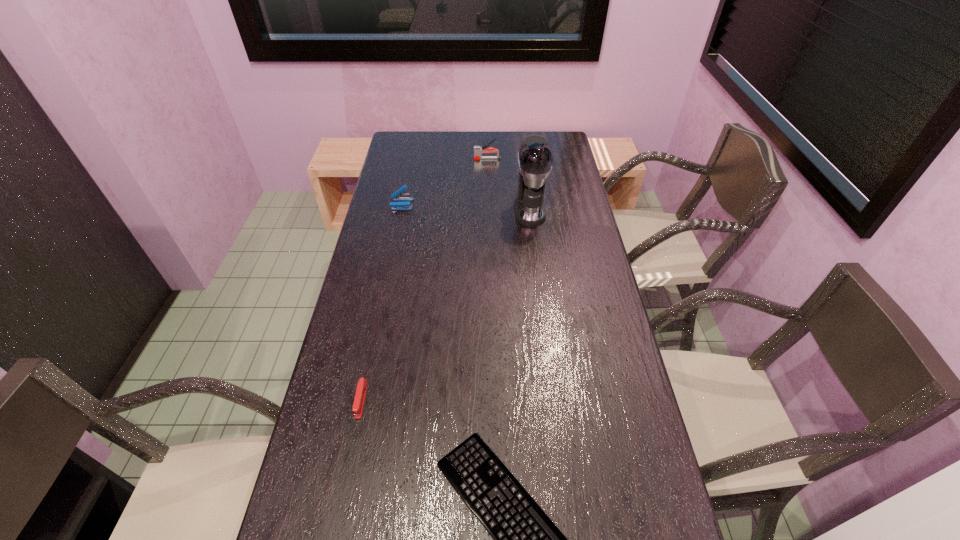
Locate an element on the screen. vacant space that satisfies the following two spatial constraints: 1. on the handle side of the tallest stapler; 2. on the front-facing side of the nearest stapler is located at coordinates (492, 400).

The width and height of the screenshot is (960, 540). I want to click on free location that satisfies the following two spatial constraints: 1. on the handle side of the tallest stapler; 2. on the front side of the second nearest stapler, so click(489, 204).